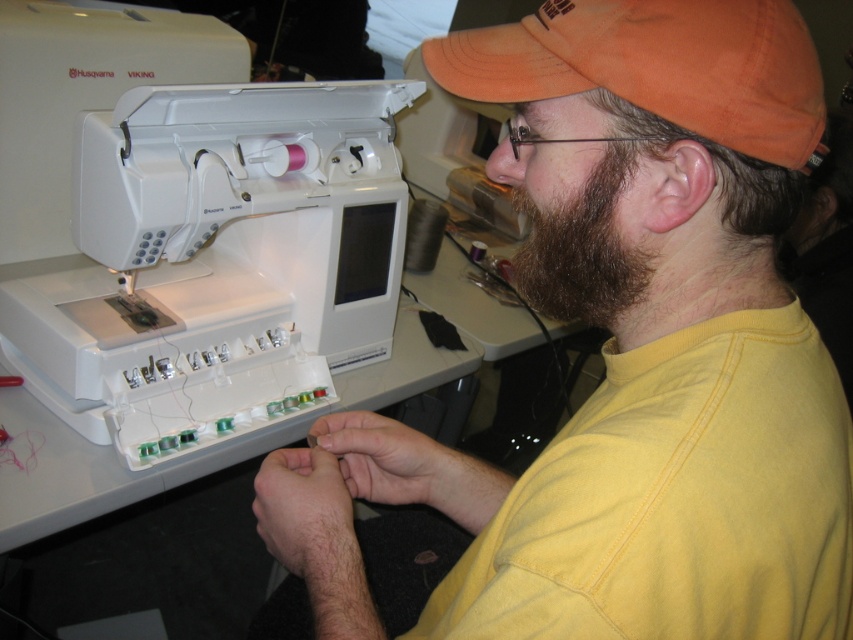
Question: Observing the image, what is the correct spatial positioning of white plastic sewing machine at left in reference to brown fuzzy beard at right?

Choices:
 (A) left
 (B) right

Answer: (A)

Question: Estimate the real-world distances between objects in this image. Which object is closer to the white plastic sewing machine at left?

Choices:
 (A) yellow cotton shirt at center
 (B) brown fuzzy beard at right
 (C) orange fabric cap at upper right

Answer: (A)

Question: Can you confirm if orange fabric cap at upper right is thinner than brown fuzzy beard at right?

Choices:
 (A) no
 (B) yes

Answer: (A)

Question: Is orange fabric cap at upper right bigger than brown fuzzy beard at right?

Choices:
 (A) yes
 (B) no

Answer: (A)

Question: Which object is positioned farthest from the yellow cotton shirt at center?

Choices:
 (A) white plastic sewing machine at left
 (B) orange fabric cap at upper right

Answer: (A)

Question: Which of the following is the farthest from the observer?

Choices:
 (A) yellow cotton shirt at center
 (B) brown fuzzy beard at right
 (C) orange fabric cap at upper right

Answer: (B)